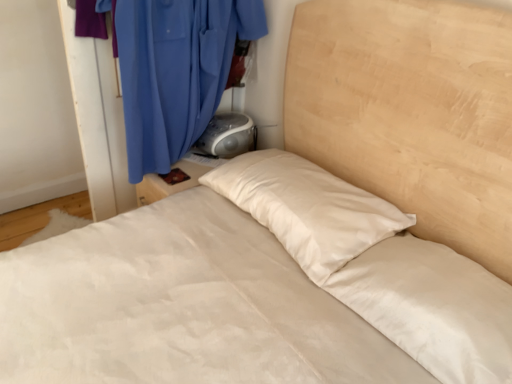
Question: Is gray plastic radio at upper right bigger or smaller than blue fabric curtain at upper left?

Choices:
 (A) big
 (B) small

Answer: (B)

Question: In the image, is gray plastic radio at upper right positioned in front of or behind blue fabric curtain at upper left?

Choices:
 (A) front
 (B) behind

Answer: (B)

Question: In terms of width, does gray plastic radio at upper right look wider or thinner when compared to blue fabric curtain at upper left?

Choices:
 (A) wide
 (B) thin

Answer: (A)

Question: Is blue fabric curtain at upper left in front of or behind gray plastic radio at upper right in the image?

Choices:
 (A) behind
 (B) front

Answer: (B)

Question: Is point (156, 31) closer or farther from the camera than point (229, 124)?

Choices:
 (A) closer
 (B) farther

Answer: (A)

Question: Would you say blue fabric curtain at upper left is to the left or to the right of gray plastic radio at upper right in the picture?

Choices:
 (A) right
 (B) left

Answer: (B)

Question: Is blue fabric curtain at upper left bigger or smaller than gray plastic radio at upper right?

Choices:
 (A) big
 (B) small

Answer: (A)